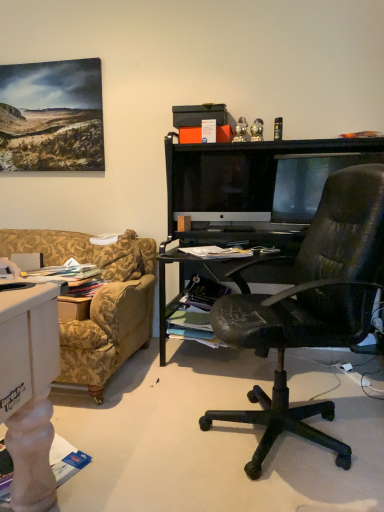
Question: Does satin black monitor at center lie behind matte black monitor at right?

Choices:
 (A) yes
 (B) no

Answer: (A)

Question: Is satin black monitor at center to the right of matte black monitor at right from the viewer's perspective?

Choices:
 (A) no
 (B) yes

Answer: (A)

Question: From the image's perspective, does satin black monitor at center appear lower than matte black monitor at right?

Choices:
 (A) no
 (B) yes

Answer: (A)

Question: From the image's perspective, is satin black monitor at center above matte black monitor at right?

Choices:
 (A) no
 (B) yes

Answer: (B)

Question: From a real-world perspective, is satin black monitor at center on top of matte black monitor at right?

Choices:
 (A) yes
 (B) no

Answer: (A)

Question: Is satin black monitor at center looking in the opposite direction of matte black monitor at right?

Choices:
 (A) yes
 (B) no

Answer: (B)

Question: Is matte black monitor at right touching satin black monitor at center?

Choices:
 (A) no
 (B) yes

Answer: (A)

Question: Is satin black monitor at center at the back of matte black monitor at right?

Choices:
 (A) yes
 (B) no

Answer: (B)

Question: Considering the relative sizes of matte black monitor at right and satin black monitor at center in the image provided, is matte black monitor at right bigger than satin black monitor at center?

Choices:
 (A) no
 (B) yes

Answer: (A)

Question: From a real-world perspective, is matte black monitor at right on top of satin black monitor at center?

Choices:
 (A) no
 (B) yes

Answer: (A)

Question: Does matte black monitor at right lie behind satin black monitor at center?

Choices:
 (A) yes
 (B) no

Answer: (B)

Question: Would you say matte black monitor at right is a long distance from satin black monitor at center?

Choices:
 (A) yes
 (B) no

Answer: (B)

Question: Is satin black monitor at center to the left or to the right of matte black monitor at right in the image?

Choices:
 (A) left
 (B) right

Answer: (A)